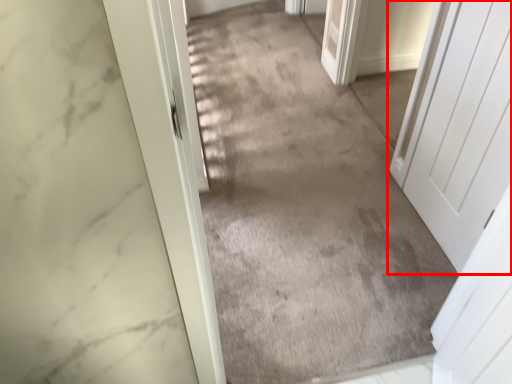
Question: From the image's perspective, what is the correct spatial relationship of door (annotated by the red box) in relation to path?

Choices:
 (A) below
 (B) above

Answer: (A)